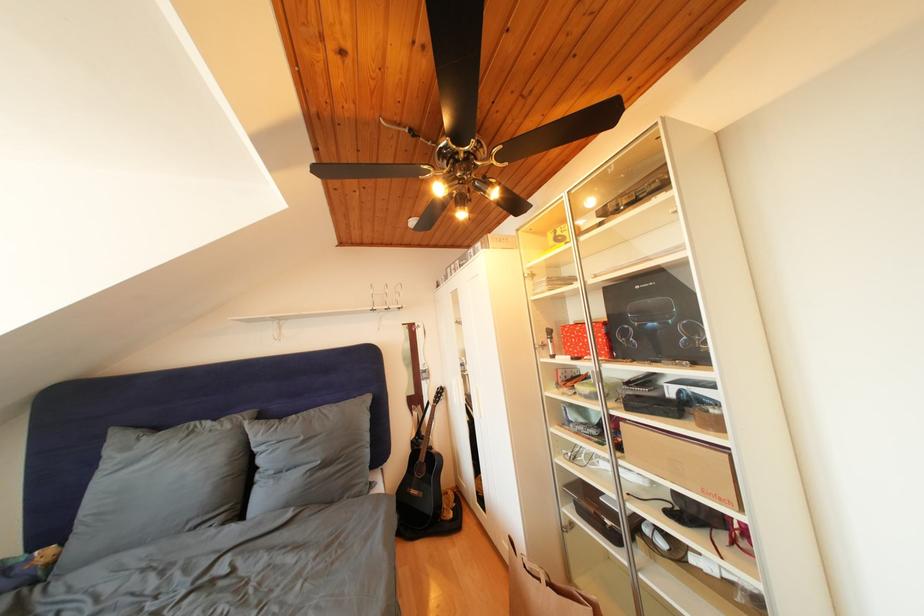
The image size is (924, 616). What do you see at coordinates (562, 131) in the screenshot?
I see `a fan pull chain` at bounding box center [562, 131].